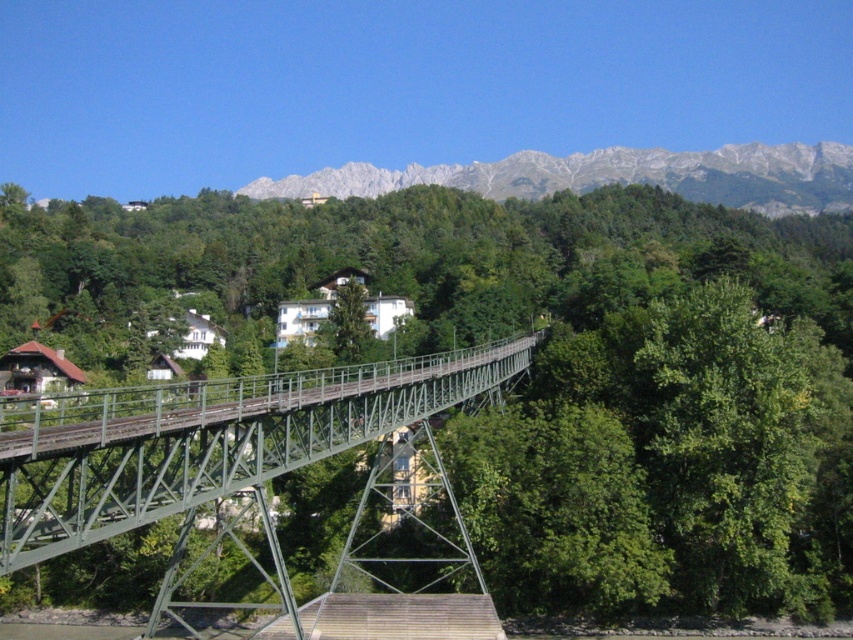
From the picture: Can you confirm if green leafy tree at center is wider than gray rocky mountain at upper center?

No.

Does point (781, 321) come farther from viewer compared to point (825, 204)?

No, (781, 321) is in front of (825, 204).

Find the location of a particular element. green leafy tree at center is located at coordinates (534, 368).

Where is `green leafy tree at center`? This screenshot has height=640, width=853. green leafy tree at center is located at coordinates (534, 368).

Does point (827, 618) come closer to viewer compared to point (83, 456)?

No.

Is green leafy tree at center positioned before green metallic bridge at center?

No, green leafy tree at center is further to the viewer.

Does point (612, 264) come closer to viewer compared to point (64, 538)?

No, it is not.

Locate an element on the screen. The image size is (853, 640). green leafy tree at center is located at coordinates (534, 368).

Locate an element on the screen. The image size is (853, 640). green metallic bridge at center is located at coordinates click(x=206, y=440).

Is green metallic bridge at center taller than gray rocky mountain at upper center?

No, green metallic bridge at center is not taller than gray rocky mountain at upper center.

Image resolution: width=853 pixels, height=640 pixels. I want to click on green metallic bridge at center, so click(x=206, y=440).

Locate an element on the screen. This screenshot has height=640, width=853. green metallic bridge at center is located at coordinates (206, 440).